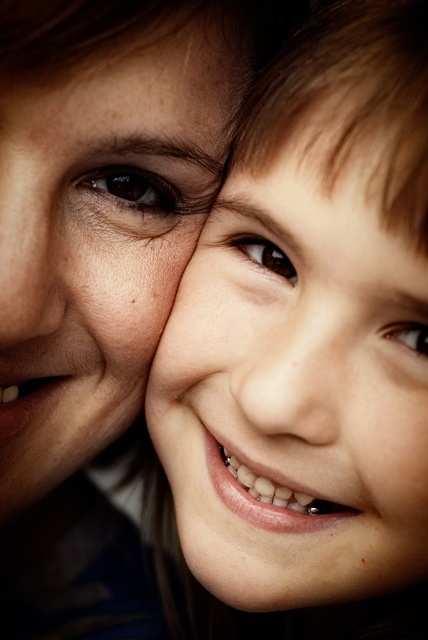
Does smooth skin at upper center lie behind smooth skin nose at center?

No, it is not.

Consider the image. Who is more distant from viewer, (x=142, y=0) or (x=311, y=300)?

Point (x=311, y=300)

The height and width of the screenshot is (640, 428). Identify the location of smooth skin at upper center. (115, 35).

Can you confirm if smooth skin face at left is positioned to the right of brown glossy eye at center?

No, smooth skin face at left is not to the right of brown glossy eye at center.

Between smooth skin face at left and brown glossy eye at center, which one appears on the right side from the viewer's perspective?

From the viewer's perspective, brown glossy eye at center appears more on the right side.

Is point (68, 445) closer to camera compared to point (235, 237)?

No, (68, 445) is behind (235, 237).

In order to click on smooth skin face at left in this screenshot , I will do `click(101, 234)`.

Is smooth skin nose at upper left thinner than brown glossy eye at center?

Incorrect, smooth skin nose at upper left's width is not less than brown glossy eye at center's.

Is smooth skin nose at upper left in front of brown glossy eye at center?

Yes, smooth skin nose at upper left is in front of brown glossy eye at center.

Is point (55, 164) closer to viewer compared to point (272, 259)?

Yes.

This screenshot has width=428, height=640. Find the location of `smooth skin nose at upper left`. smooth skin nose at upper left is located at coordinates (30, 244).